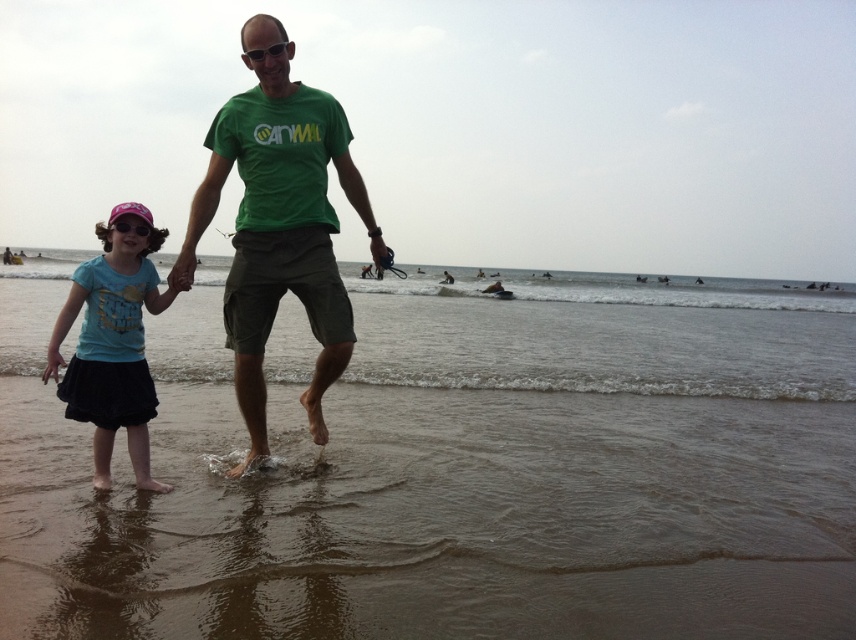
Question: Is green cotton t-shirt at center above pink plastic goggles at left?

Choices:
 (A) yes
 (B) no

Answer: (B)

Question: Which of the following is the farthest from the observer?

Choices:
 (A) pink plastic goggles at left
 (B) blue cotton shirt at lower left
 (C) green cotton t-shirt at center

Answer: (A)

Question: Considering the real-world distances, which object is farthest from the pink plastic goggles at left?

Choices:
 (A) green cotton t-shirt at center
 (B) blue cotton shirt at lower left

Answer: (A)

Question: Does blue cotton shirt at lower left appear over pink plastic goggles at left?

Choices:
 (A) no
 (B) yes

Answer: (A)

Question: Which point is closer to the camera?

Choices:
 (A) (146, 234)
 (B) (226, 147)

Answer: (A)

Question: Is green cotton t-shirt at center smaller than blue cotton shirt at lower left?

Choices:
 (A) no
 (B) yes

Answer: (A)